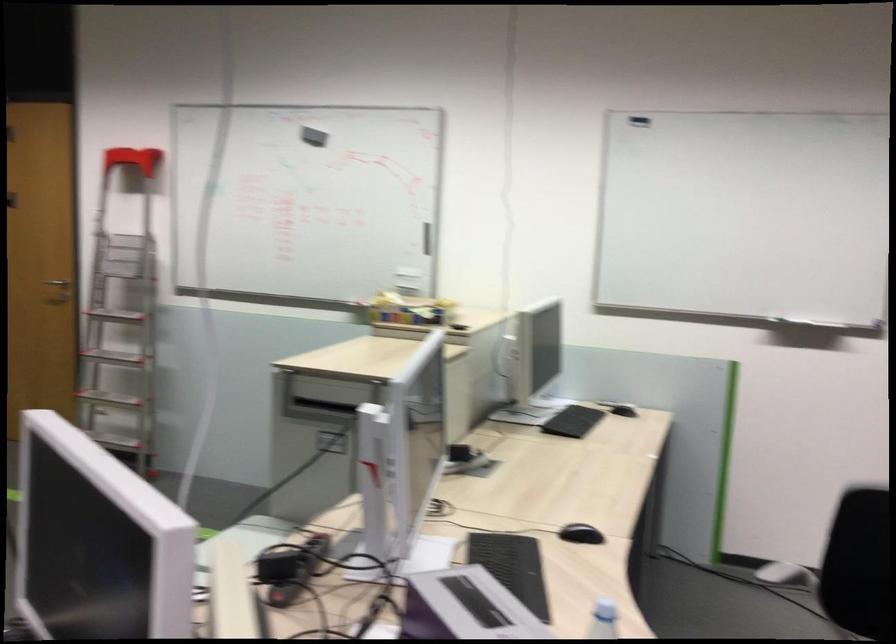
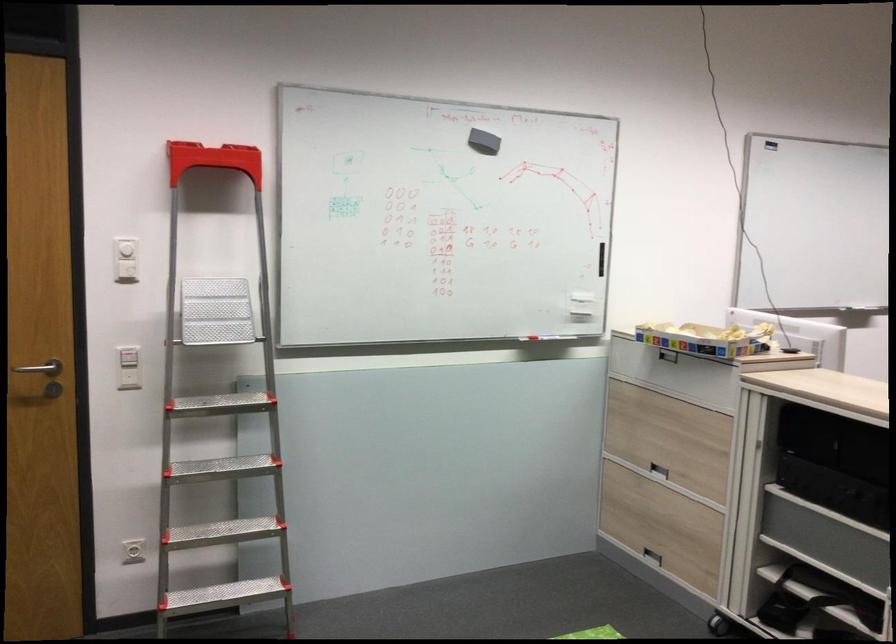
Locate, in the second image, the point that corresponds to pixel 149 218 in the first image.

(125, 269)